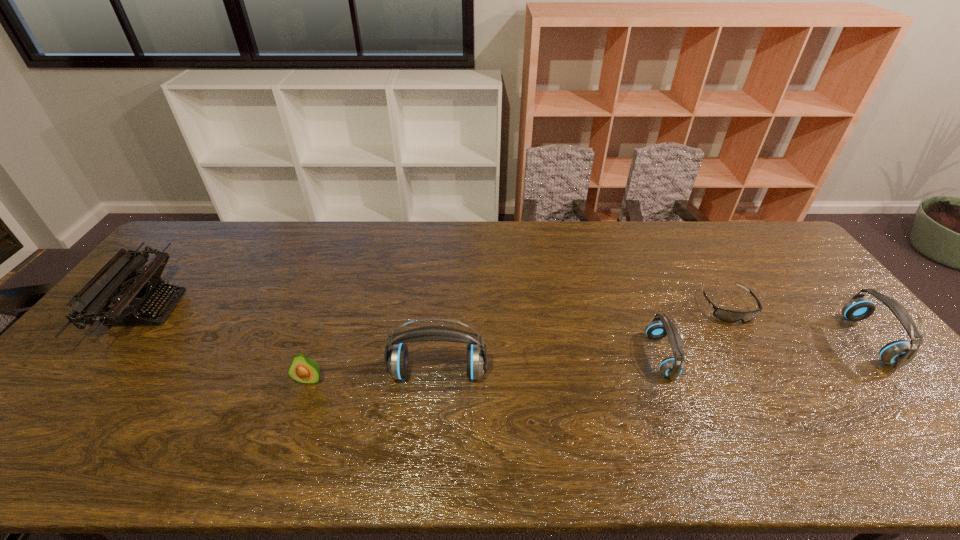
Find the location of a particular element. This screenshot has width=960, height=540. empty location between the fourth object from right to left and the shortest object is located at coordinates (583, 340).

Identify the location of free space between the leftmost headset and the second headset from left to right. This screenshot has width=960, height=540. (549, 364).

Point out which object is positioned as the third nearest to the shortest headset. Please provide its 2D coordinates. Your answer should be formatted as a tuple, i.e. [(x, y)], where the tuple contains the x and y coordinates of a point satisfying the conditions above.

[(899, 353)]

Select which object appears as the closest to the shortest headset. Please provide its 2D coordinates. Your answer should be formatted as a tuple, i.e. [(x, y)], where the tuple contains the x and y coordinates of a point satisfying the conditions above.

[(730, 316)]

Where is `the second closest headset to the tallest object`? Image resolution: width=960 pixels, height=540 pixels. the second closest headset to the tallest object is located at coordinates (899, 353).

The width and height of the screenshot is (960, 540). In order to click on the closest headset relative to the rightmost headset in this screenshot , I will do `click(661, 326)`.

In order to click on free space that satisfies the following two spatial constraints: 1. on the lenses of the fifth object from left to right; 2. on the typing side of the leftmost object in this screenshot , I will do `click(729, 309)`.

At what (x,y) coordinates should I click in order to perform the action: click on free location that satisfies the following two spatial constraints: 1. on the ear cups of the rightmost headset; 2. on the cut side of the avocado. Please return your answer as a coordinate pair (x, y). Looking at the image, I should click on [903, 380].

Identify the location of free spot that satisfies the following two spatial constraints: 1. on the ear cups of the rightmost headset; 2. on the cut side of the avocado. The width and height of the screenshot is (960, 540). (903, 380).

The height and width of the screenshot is (540, 960). I want to click on free spot that satisfies the following two spatial constraints: 1. on the ear cups of the shortest headset; 2. on the cut side of the second object from left to right, so click(670, 380).